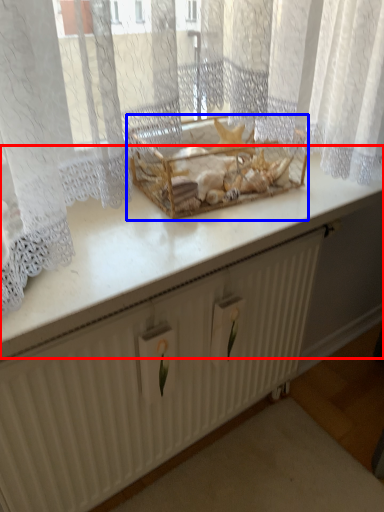
Question: Which object appears farthest to the camera in this image, counter top (highlighted by a red box) or crate (highlighted by a blue box)?

Choices:
 (A) counter top
 (B) crate

Answer: (B)